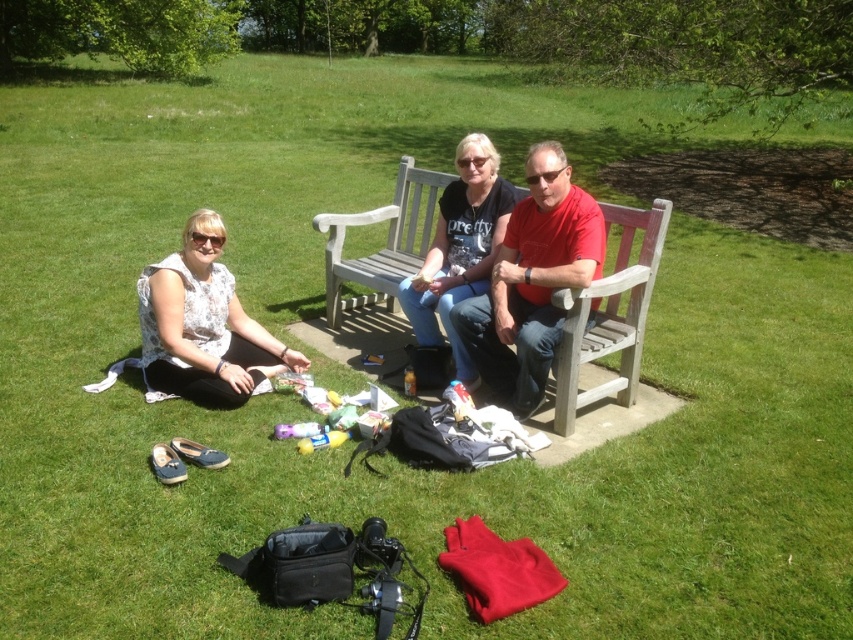
You are planning to take a photo of the wooden park bench at center and the red matte shirt at center. Which object should you focus on first if you want to capture both in the frame without moving the camera?

The wooden park bench at center is to the left of the red matte shirt at center, so you should focus on the wooden park bench at center first to ensure both are in the frame without moving the camera.

You are a photographer standing in the park. You want to take a photo of the wooden park bench at center and the red matte shirt at center. Which object should you focus on first if you want to capture both in the same frame without moving the camera?

The wooden park bench at center is located above the red matte shirt at center, so you should focus on the wooden park bench at center first to ensure both are in the frame.